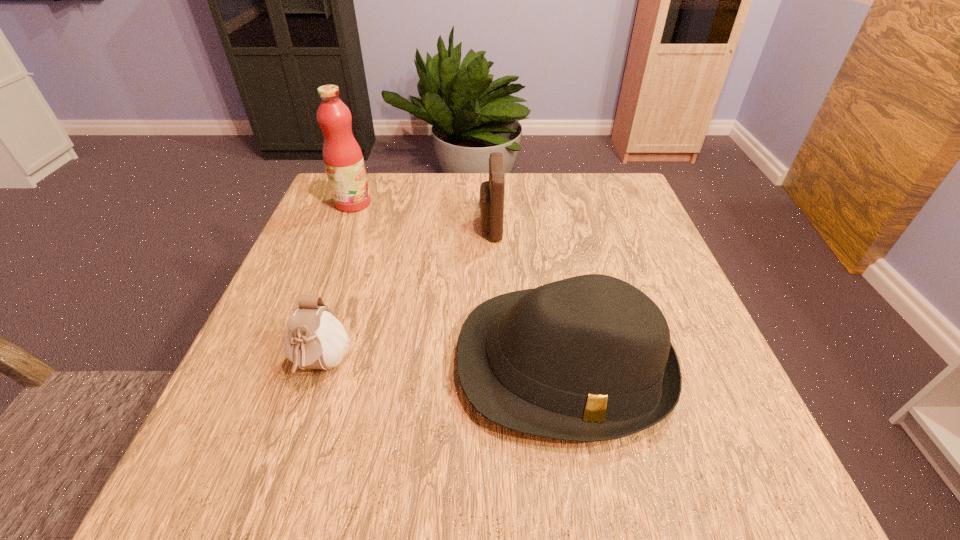
Where is `unoccupied area between the shorter pouch and the fedora`? Image resolution: width=960 pixels, height=540 pixels. unoccupied area between the shorter pouch and the fedora is located at coordinates (443, 365).

This screenshot has width=960, height=540. I want to click on free space between the fruit juice and the right pouch, so click(421, 215).

Image resolution: width=960 pixels, height=540 pixels. What are the coordinates of `the second closest object to the taller pouch` in the screenshot? It's located at (342, 156).

Find the location of a particular element. The height and width of the screenshot is (540, 960). the second closest object to the tallest object is located at coordinates (589, 358).

Where is `vacant area that satisfies the following two spatial constraints: 1. with an open flap on the farther pouch; 2. on the front-facing side of the shortest object`? The width and height of the screenshot is (960, 540). vacant area that satisfies the following two spatial constraints: 1. with an open flap on the farther pouch; 2. on the front-facing side of the shortest object is located at coordinates (494, 366).